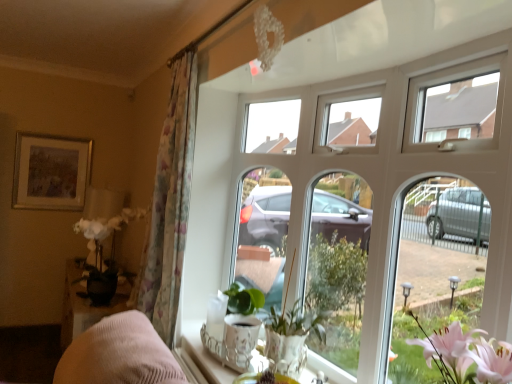
Question: Is white ceramic tray at lower center positioned before green matte plant at center?

Choices:
 (A) no
 (B) yes

Answer: (B)

Question: Is white ceramic tray at lower center facing towards green matte plant at center?

Choices:
 (A) yes
 (B) no

Answer: (B)

Question: Is white ceramic tray at lower center beside green matte plant at center?

Choices:
 (A) no
 (B) yes

Answer: (A)

Question: Considering the relative sizes of white ceramic tray at lower center and green matte plant at center in the image provided, is white ceramic tray at lower center shorter than green matte plant at center?

Choices:
 (A) yes
 (B) no

Answer: (A)

Question: Is white ceramic tray at lower center further to camera compared to green matte plant at center?

Choices:
 (A) no
 (B) yes

Answer: (A)

Question: Considering the relative sizes of white ceramic tray at lower center and green matte plant at center in the image provided, is white ceramic tray at lower center bigger than green matte plant at center?

Choices:
 (A) no
 (B) yes

Answer: (A)

Question: Does floral fabric curtain at left come in front of translucent glass vase at lower center?

Choices:
 (A) yes
 (B) no

Answer: (B)

Question: Does floral fabric curtain at left appear on the right side of translucent glass vase at lower center?

Choices:
 (A) yes
 (B) no

Answer: (B)

Question: Can you confirm if floral fabric curtain at left is shorter than translucent glass vase at lower center?

Choices:
 (A) yes
 (B) no

Answer: (B)

Question: Is floral fabric curtain at left bigger than translucent glass vase at lower center?

Choices:
 (A) no
 (B) yes

Answer: (B)

Question: Considering the relative sizes of floral fabric curtain at left and translucent glass vase at lower center in the image provided, is floral fabric curtain at left smaller than translucent glass vase at lower center?

Choices:
 (A) no
 (B) yes

Answer: (A)

Question: Does floral fabric curtain at left come behind translucent glass vase at lower center?

Choices:
 (A) yes
 (B) no

Answer: (A)

Question: Is translucent glass vase at lower center in contact with white ceramic tray at lower center?

Choices:
 (A) yes
 (B) no

Answer: (B)